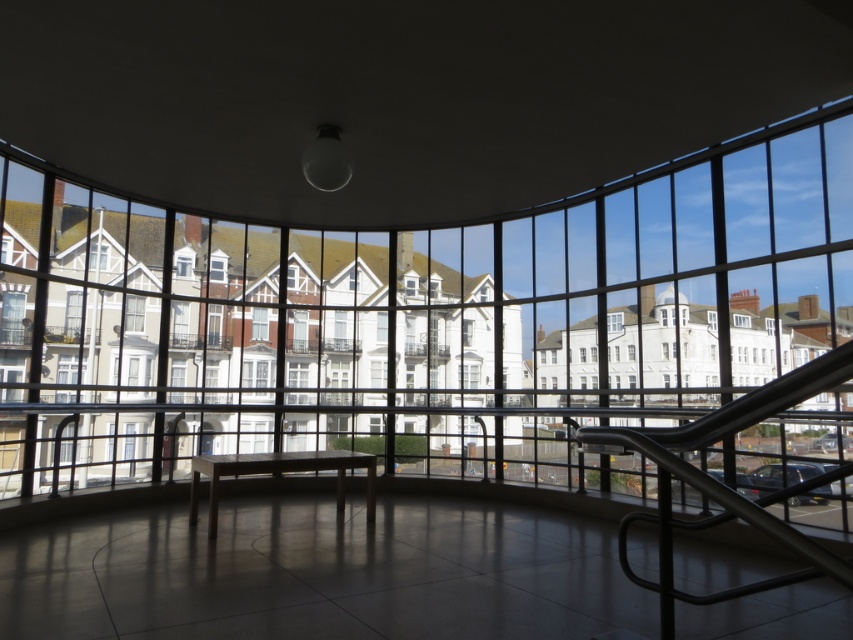
Question: Is clear glass window at upper left to the right of clear glass window at center from the viewer's perspective?

Choices:
 (A) yes
 (B) no

Answer: (B)

Question: Estimate the real-world distances between objects in this image. Which object is farther from the clear glass window at center?

Choices:
 (A) clear glass window at upper left
 (B) wooden at center

Answer: (B)

Question: Which point is farther from the camera taking this photo?

Choices:
 (A) (339, 465)
 (B) (611, 321)
 (C) (97, 243)

Answer: (B)

Question: Which object appears farthest from the camera in this image?

Choices:
 (A) wooden at center
 (B) clear glass window at upper left
 (C) clear glass window at center

Answer: (C)

Question: Is wooden at center closer to the viewer compared to clear glass window at upper left?

Choices:
 (A) yes
 (B) no

Answer: (A)

Question: Is clear glass window at upper left positioned at the back of clear glass window at center?

Choices:
 (A) no
 (B) yes

Answer: (A)